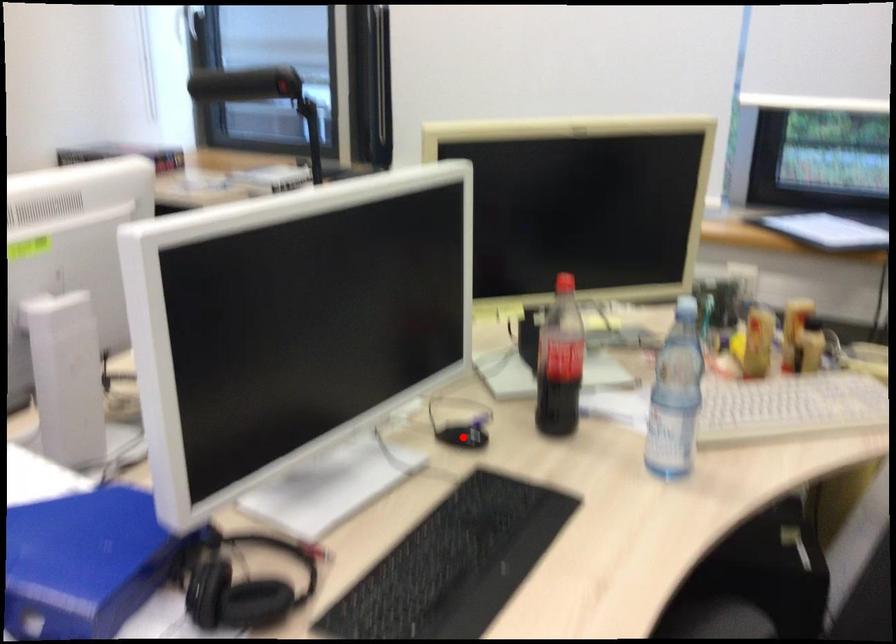
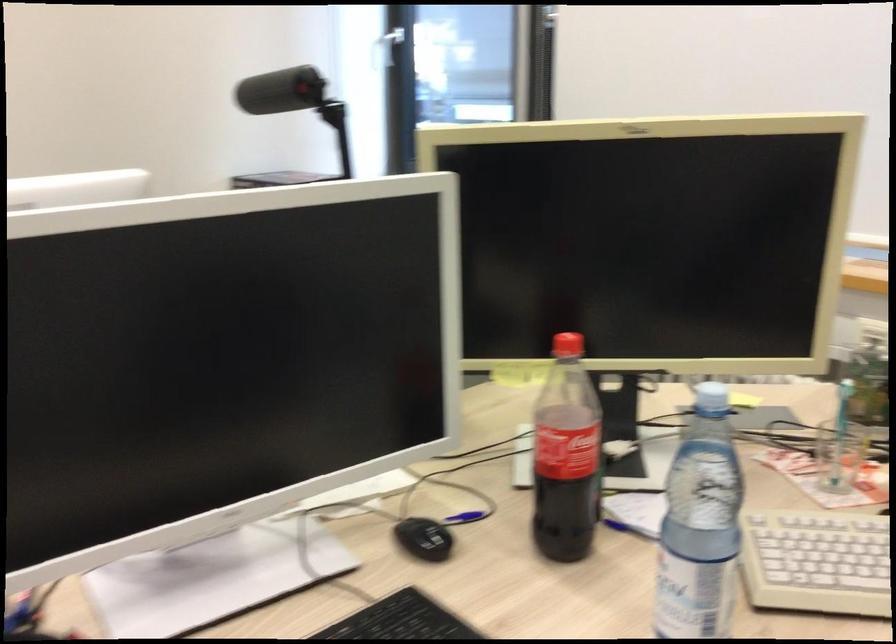
The point at the highlighted location is marked in the first image. Where is the corresponding point in the second image?

(424, 538)